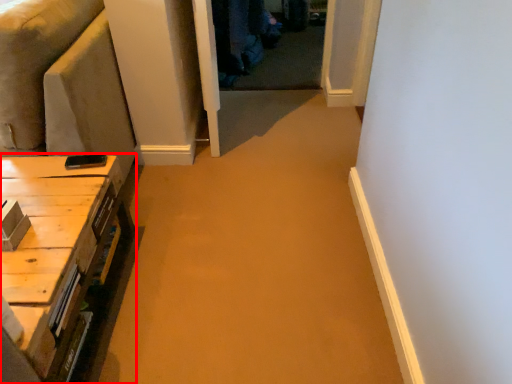
Question: From the image's perspective, where is table (annotated by the red box) located relative to couch?

Choices:
 (A) below
 (B) above

Answer: (A)